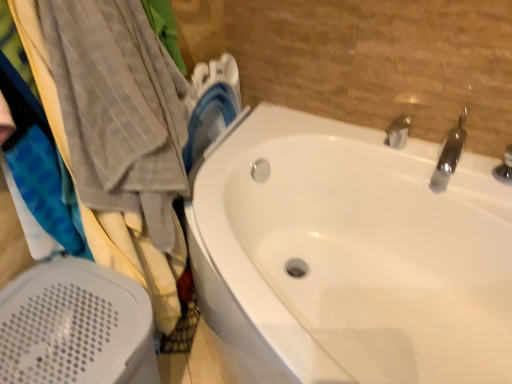
Where is `unoccupied region to the right of silver metallic tap at upper right, which ranks as the first tap in left-to-right order`? The image size is (512, 384). unoccupied region to the right of silver metallic tap at upper right, which ranks as the first tap in left-to-right order is located at coordinates (437, 157).